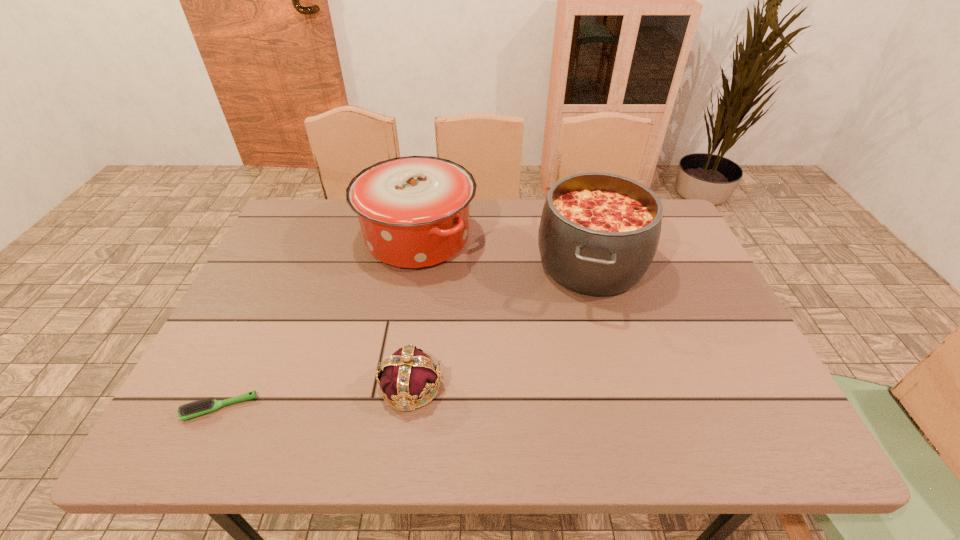
You are a GUI agent. You are given a task and a screenshot of the screen. Output one action in this format:
    pyautogui.click(x=<x>, y=<y>)
    Task: Click on the hairbrush positioned at the near edge
    
    Given the screenshot: What is the action you would take?
    pyautogui.click(x=203, y=406)

This screenshot has width=960, height=540. What are the coordinates of `object at the left edge` in the screenshot? It's located at (203, 406).

Locate an element on the screen. Image resolution: width=960 pixels, height=540 pixels. object that is at the right edge is located at coordinates (599, 232).

The width and height of the screenshot is (960, 540). Find the location of `object that is at the near left corner`. object that is at the near left corner is located at coordinates click(203, 406).

The width and height of the screenshot is (960, 540). I want to click on object at the far right corner, so click(x=599, y=232).

Where is `blank space at the far edge`? The height and width of the screenshot is (540, 960). blank space at the far edge is located at coordinates (504, 245).

The image size is (960, 540). I want to click on vacant region at the near edge of the desktop, so click(x=474, y=434).

Identify the location of vacant space at the left edge of the desktop. Image resolution: width=960 pixels, height=540 pixels. click(237, 319).

Where is `free region at the right edge`? The image size is (960, 540). free region at the right edge is located at coordinates (684, 360).

Locate an element on the screen. The height and width of the screenshot is (540, 960). vacant space at the near right corner of the desktop is located at coordinates (724, 419).